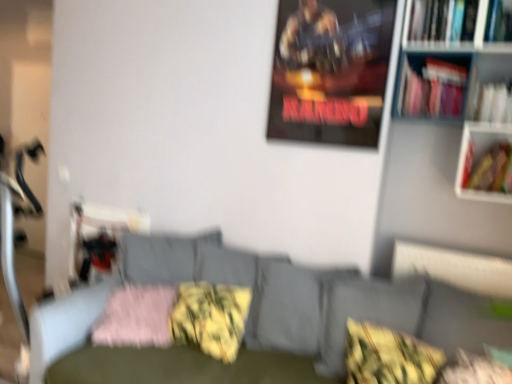
The height and width of the screenshot is (384, 512). What do you see at coordinates (456, 25) in the screenshot?
I see `hardcover book at upper right, the first book viewed from the top` at bounding box center [456, 25].

You are a GUI agent. You are given a task and a screenshot of the screen. Output one action in this format:
    pyautogui.click(x=<x>, y=<y>)
    Task: Click on the yellow-green textured pillow at lower right, acting as the fourth pillow starting from the left
    The image size is (512, 384).
    Given the screenshot: What is the action you would take?
    pyautogui.click(x=474, y=370)

Locate an element on the screen. Image resolution: width=512 pixels, height=384 pixels. yellow-green textured pillow at center, placed as the 2th pillow when sorted from left to right is located at coordinates (210, 318).

Is white paper at upper right, positioned as the 2th book in top-to-bottom order, to the left of yellow-green textured pillow at lower right, acting as the fourth pillow starting from the left, from the viewer's perspective?

Incorrect, white paper at upper right, positioned as the 2th book in top-to-bottom order, is not on the left side of yellow-green textured pillow at lower right, acting as the fourth pillow starting from the left.

Could yellow-green textured pillow at lower right, acting as the fourth pillow starting from the left, be considered to be inside white paper at upper right, positioned as the 2th book in top-to-bottom order?

No, yellow-green textured pillow at lower right, acting as the fourth pillow starting from the left, is not a part of white paper at upper right, positioned as the 2th book in top-to-bottom order.

I want to click on the 3rd book counting from the right side of the yellow-green textured pillow at lower right, placed as the first pillow when sorted from right to left, so click(493, 103).

Considering the relative positions of white plastic bookcase at right and white paper at upper right, positioned as the 2th book in top-to-bottom order, in the image provided, is white plastic bookcase at right to the right of white paper at upper right, positioned as the 2th book in top-to-bottom order, from the viewer's perspective?

Incorrect, white plastic bookcase at right is not on the right side of white paper at upper right, positioned as the 2th book in top-to-bottom order.

Does white plastic bookcase at right turn towards white paper at upper right, arranged as the second book when ordered from the bottom?

Yes, white plastic bookcase at right faces towards white paper at upper right, arranged as the second book when ordered from the bottom.

Is white plastic bookcase at right next to white paper at upper right, positioned as the 2th book in top-to-bottom order?

white plastic bookcase at right and white paper at upper right, positioned as the 2th book in top-to-bottom order, are not in contact.

Does white paper at upper right, arranged as the second book when ordered from the bottom, lie behind yellow-green textured pillow at center, which ranks as the 3th pillow in right-to-left order?

Yes, white paper at upper right, arranged as the second book when ordered from the bottom, is behind yellow-green textured pillow at center, which ranks as the 3th pillow in right-to-left order.

Is white paper at upper right, arranged as the second book when ordered from the bottom, not near yellow-green textured pillow at center, placed as the 2th pillow when sorted from left to right?

Yes.

Does point (502, 114) come in front of point (207, 304)?

Yes, it is.

Is white paper at upper right, arranged as the second book when ordered from the bottom, positioned with its back to yellow-green textured pillow at center, placed as the 2th pillow when sorted from left to right?

No, white paper at upper right, arranged as the second book when ordered from the bottom,'s orientation is not away from yellow-green textured pillow at center, placed as the 2th pillow when sorted from left to right.

Is point (472, 31) positioned in front of point (405, 47)?

Yes, point (472, 31) is in front of point (405, 47).

From a real-world perspective, which object stands above the other?

hardcover book at upper right, the first book viewed from the top.

From their relative heights in the image, would you say hardcover book at upper right, the first book viewed from the top, is taller or shorter than white plastic bookcase at right?

hardcover book at upper right, the first book viewed from the top, is shorter than white plastic bookcase at right.

From a real-world perspective, between textured gray couch at center and white paper at upper right, arranged as the second book when ordered from the bottom, who is vertically lower?

In real-world perspective, textured gray couch at center is lower.

Looking at their sizes, would you say textured gray couch at center is wider or thinner than white paper at upper right, arranged as the second book when ordered from the bottom?

In the image, textured gray couch at center appears to be wider than white paper at upper right, arranged as the second book when ordered from the bottom.

Measure the distance from textured gray couch at center to white paper at upper right, positioned as the 2th book in top-to-bottom order.

textured gray couch at center is 3.87 feet from white paper at upper right, positioned as the 2th book in top-to-bottom order.

Is textured gray couch at center taller than white paper at upper right, positioned as the 2th book in top-to-bottom order?

Yes.

Consider the image. From a real-world perspective, is yellow-green textured pillow at center, placed as the 2th pillow when sorted from left to right, over metallic poster at upper center?

No, from a real-world perspective, yellow-green textured pillow at center, placed as the 2th pillow when sorted from left to right, is not on top of metallic poster at upper center.

Considering the relative sizes of yellow-green textured pillow at center, placed as the 2th pillow when sorted from left to right, and metallic poster at upper center in the image provided, is yellow-green textured pillow at center, placed as the 2th pillow when sorted from left to right, shorter than metallic poster at upper center?

Correct, yellow-green textured pillow at center, placed as the 2th pillow when sorted from left to right, is not as tall as metallic poster at upper center.

Is yellow-green textured pillow at center, which ranks as the 3th pillow in right-to-left order, touching metallic poster at upper center?

No, yellow-green textured pillow at center, which ranks as the 3th pillow in right-to-left order, is not with metallic poster at upper center.

Is yellow-green textured pillow at center, which ranks as the 3th pillow in right-to-left order, facing towards metallic poster at upper center?

No, yellow-green textured pillow at center, which ranks as the 3th pillow in right-to-left order, is not oriented towards metallic poster at upper center.

Consider the image. Who is shorter, yellow-green textured pillow at center, which is the second pillow from right to left, or hardcover book at upper right, the first book viewed from the top?

With less height is hardcover book at upper right, the first book viewed from the top.

From the hardcover book at upper right, the first book viewed from the top, count 2nd pillows forward and point to it. Please provide its 2D coordinates.

[(388, 356)]

Which is correct: yellow-green textured pillow at center, which is the second pillow from right to left, is inside hardcover book at upper right, acting as the 3th book starting from the bottom, or outside of it?

yellow-green textured pillow at center, which is the second pillow from right to left, exists outside the volume of hardcover book at upper right, acting as the 3th book starting from the bottom.

Is there a large distance between yellow-green textured pillow at center, the third pillow when ordered from left to right, and hardcover book at upper right, acting as the 3th book starting from the bottom?

Yes, yellow-green textured pillow at center, the third pillow when ordered from left to right, and hardcover book at upper right, acting as the 3th book starting from the bottom, are located far from each other.

From a real-world perspective, count 1st pillows downward from the white paper at upper right, positioned as the 2th book in top-to-bottom order, and point to it. Please provide its 2D coordinates.

[(474, 370)]

I want to click on bookcase in front of the white paper at upper right, arranged as the second book when ordered from the bottom, so click(x=466, y=99).

Based on their spatial positions, is pink fluffy pillow at lower left, arranged as the 4th pillow when viewed from the right, or textured gray couch at center closer to hardcover book at right, placed as the 1th book when sorted from bottom to top?

The object closer to hardcover book at right, placed as the 1th book when sorted from bottom to top, is textured gray couch at center.

Based on their spatial positions, is textured gray couch at center or black leather swivel chair at center further from yellow-green textured pillow at center, which ranks as the 3th pillow in right-to-left order?

The object further to yellow-green textured pillow at center, which ranks as the 3th pillow in right-to-left order, is black leather swivel chair at center.

From the image, which object appears to be nearer to metallic poster at upper center, yellow-green textured pillow at lower right, placed as the first pillow when sorted from right to left, or white paper at upper right, positioned as the 2th book in top-to-bottom order?

white paper at upper right, positioned as the 2th book in top-to-bottom order, is closer to metallic poster at upper center.

Which object lies further to the anchor point yellow-green textured pillow at center, placed as the 2th pillow when sorted from left to right, white paper at upper right, positioned as the 2th book in top-to-bottom order, or hardcover book at right, the third book positioned from the top?

Based on the image, white paper at upper right, positioned as the 2th book in top-to-bottom order, appears to be further to yellow-green textured pillow at center, placed as the 2th pillow when sorted from left to right.

Which object lies nearer to the anchor point metallic poster at upper center, pink fluffy pillow at lower left, arranged as the 4th pillow when viewed from the right, or textured gray couch at center?

Among the two, textured gray couch at center is located nearer to metallic poster at upper center.

Looking at this image, based on their spatial positions, is hardcover book at upper right, acting as the 3th book starting from the bottom, or yellow-green textured pillow at center, which ranks as the 3th pillow in right-to-left order, further from textured gray couch at center?

hardcover book at upper right, acting as the 3th book starting from the bottom, lies further to textured gray couch at center than the other object.

Estimate the real-world distances between objects in this image. Which object is closer to yellow-green textured pillow at center, placed as the 2th pillow when sorted from left to right, black leather swivel chair at center or white paper at upper right, positioned as the 2th book in top-to-bottom order?

Based on the image, black leather swivel chair at center appears to be nearer to yellow-green textured pillow at center, placed as the 2th pillow when sorted from left to right.

When comparing their distances from yellow-green textured pillow at center, placed as the 2th pillow when sorted from left to right, does textured gray couch at center or yellow-green textured pillow at lower right, placed as the first pillow when sorted from right to left, seem closer?

textured gray couch at center.

At what (x,y) coordinates should I click in order to perform the action: click on bookcase positioned between textured gray couch at center and yellow-green textured pillow at center, placed as the 2th pillow when sorted from left to right, from near to far. Please return your answer as a coordinate pair (x, y). The width and height of the screenshot is (512, 384). Looking at the image, I should click on (466, 99).

Identify the location of bookcase located between textured gray couch at center and black leather swivel chair at center in the depth direction. (466, 99).

Locate an element on the screen. picture frame between hardcover book at upper right, acting as the 3th book starting from the bottom, and yellow-green textured pillow at center, the third pillow when ordered from left to right, in the up-down direction is located at coordinates (330, 70).

Identify the location of book between white plastic bookcase at right and hardcover book at right, placed as the 1th book when sorted from bottom to top, in the up-down direction. The height and width of the screenshot is (384, 512). (493, 103).